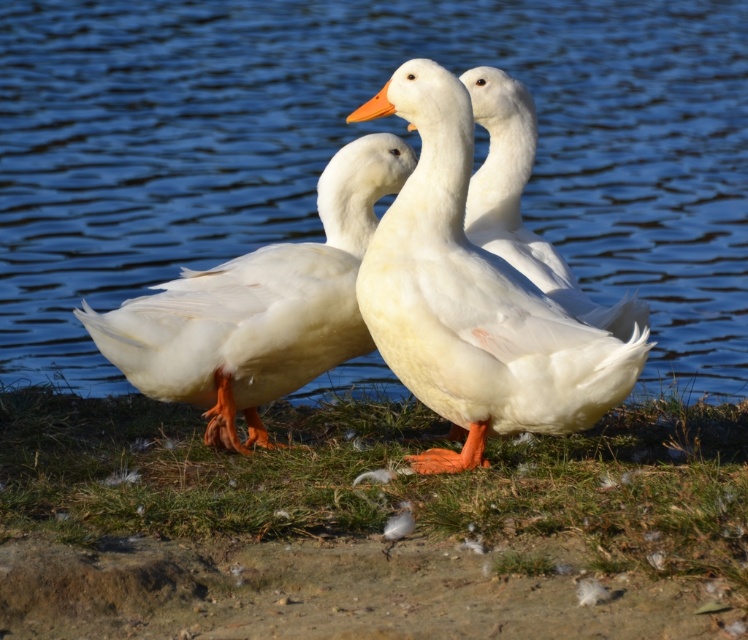
Measure the distance between blue water at center and white matte duck at center.

3.65 meters

Which is more to the right, blue water at center or white matte duck at center?

white matte duck at center

Is point (554, 202) in front of point (577, 372)?

No, it is not.

The width and height of the screenshot is (748, 640). In order to click on blue water at center in this screenshot , I will do `click(352, 138)`.

Does green grass at center come in front of white feathered duck at center?

Yes, it is in front of white feathered duck at center.

Based on the photo, which of these two, green grass at center or white feathered duck at center, stands shorter?

Standing shorter between the two is green grass at center.

Where is `green grass at center`? green grass at center is located at coordinates (364, 524).

Between blue water at center and green grass at center, which one is positioned lower?

green grass at center is below.

The width and height of the screenshot is (748, 640). Describe the element at coordinates (352, 138) in the screenshot. I see `blue water at center` at that location.

At what (x,y) coordinates should I click in order to perform the action: click on blue water at center. Please return your answer as a coordinate pair (x, y). This screenshot has height=640, width=748. Looking at the image, I should click on point(352,138).

Where is `blue water at center`? blue water at center is located at coordinates (352, 138).